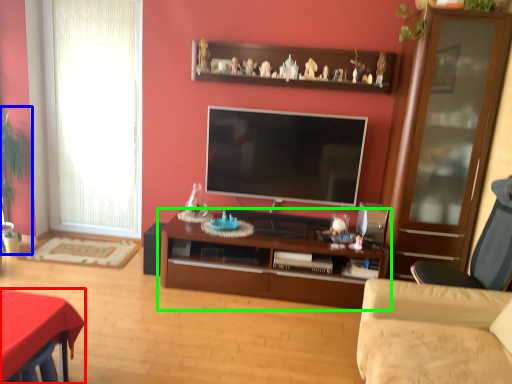
Question: Estimate the real-world distances between objects in this image. Which object is closer to desk (highlighted by a red box), plant (highlighted by a blue box) or cabinetry (highlighted by a green box)?

Choices:
 (A) plant
 (B) cabinetry

Answer: (B)